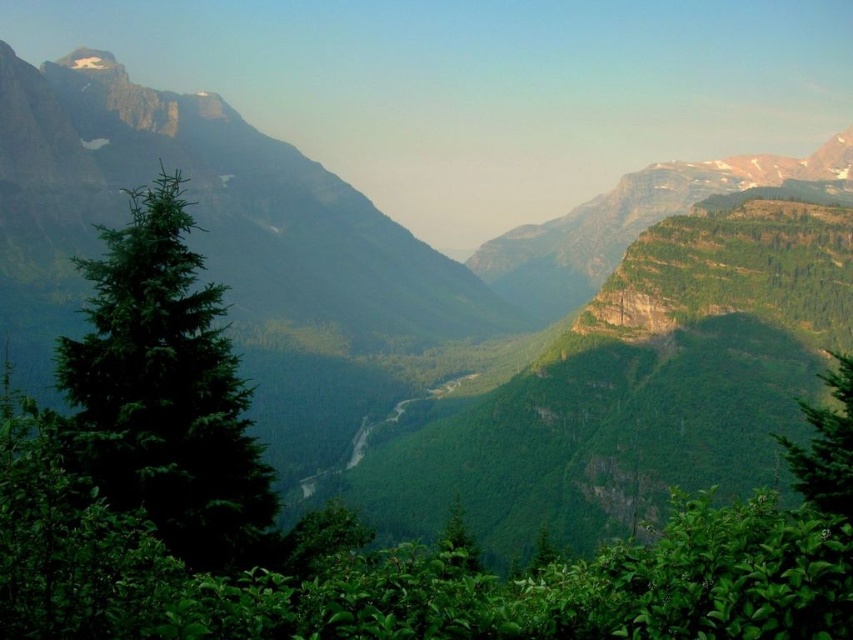
Question: Which point is closer to the camera?

Choices:
 (A) green leafy tree at right
 (B) green matte tree at left

Answer: (A)

Question: Is green matte tree at left smaller than green leafy tree at right?

Choices:
 (A) yes
 (B) no

Answer: (B)

Question: Is green matte tree at left below green leafy tree at right?

Choices:
 (A) yes
 (B) no

Answer: (B)

Question: Which of the following is the closest to the observer?

Choices:
 (A) (123, 364)
 (B) (849, 420)

Answer: (A)

Question: Which of the following is the closest to the observer?

Choices:
 (A) (827, 509)
 (B) (102, 388)

Answer: (B)

Question: Can you confirm if green matte tree at left is thinner than green leafy tree at right?

Choices:
 (A) no
 (B) yes

Answer: (A)